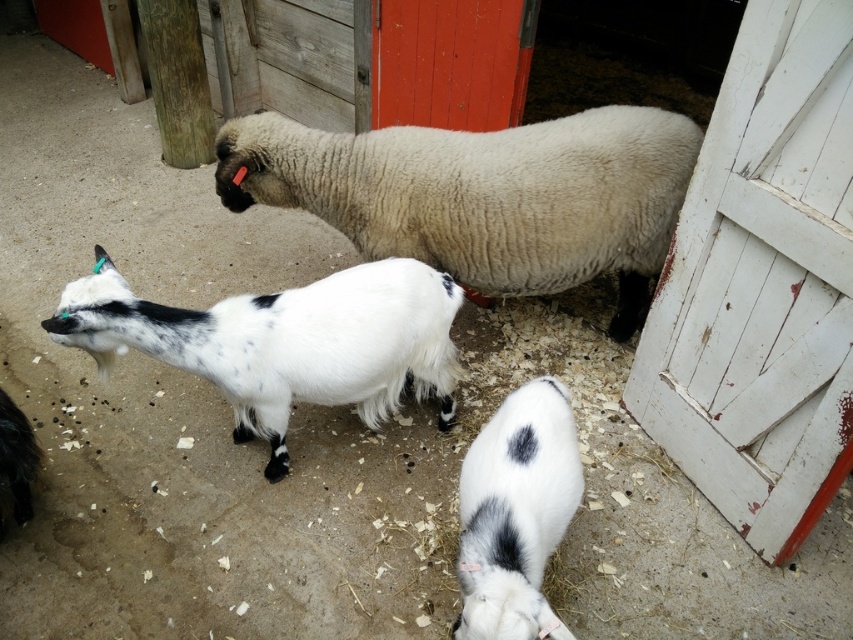
Between point (641, 234) and point (543, 451), which one is positioned in front?

Positioned in front is point (543, 451).

Which is more to the right, white woolen sheep at center or white soft fur goat at lower center?

white soft fur goat at lower center

Who is more forward, (432, 145) or (556, 477)?

Point (556, 477) is more forward.

What are the coordinates of `white woolen sheep at center` in the screenshot? It's located at (485, 195).

Who is positioned more to the right, white speckled fur goat at center or white soft fur goat at lower center?

white soft fur goat at lower center is more to the right.

The width and height of the screenshot is (853, 640). Describe the element at coordinates (285, 342) in the screenshot. I see `white speckled fur goat at center` at that location.

Which is behind, point (405, 275) or point (543, 401)?

Positioned behind is point (405, 275).

At what (x,y) coordinates should I click in order to perform the action: click on white speckled fur goat at center. Please return your answer as a coordinate pair (x, y). Looking at the image, I should click on (285, 342).

Can you confirm if white woolen sheep at center is taller than white speckled fur goat at center?

Yes.

How distant is white woolen sheep at center from white speckled fur goat at center?

The distance of white woolen sheep at center from white speckled fur goat at center is 21.29 inches.

Which is in front, point (439, 186) or point (64, 305)?

Point (64, 305)

Where is `white woolen sheep at center`? This screenshot has width=853, height=640. white woolen sheep at center is located at coordinates (485, 195).